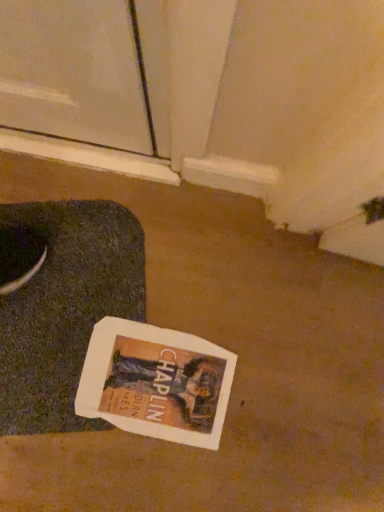
What are the coordinates of `vacant point to the right of white paper magazine at center` in the screenshot? It's located at (257, 418).